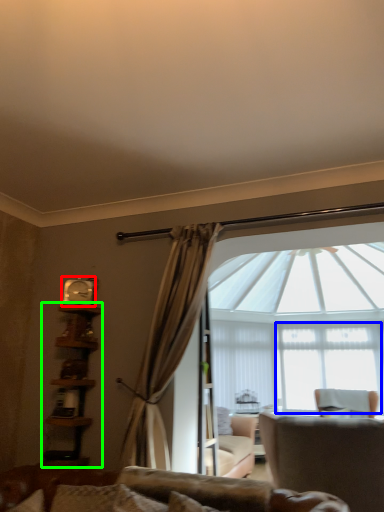
Question: Which is nearer to the clock (highlighted by a red box)? window screen (highlighted by a blue box) or bookshelf (highlighted by a green box).

Choices:
 (A) window screen
 (B) bookshelf

Answer: (B)